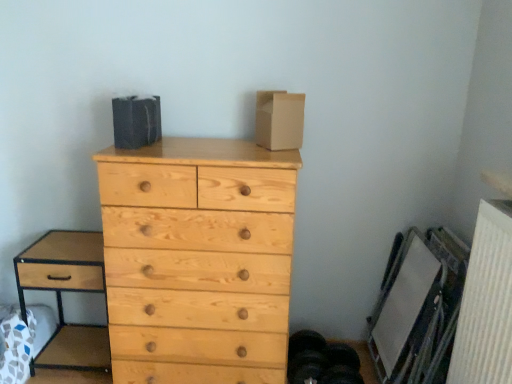
This screenshot has width=512, height=384. What do you see at coordinates (61, 297) in the screenshot?
I see `brown wood nightstand at left` at bounding box center [61, 297].

The image size is (512, 384). I want to click on natural wood chest of drawers at center, so (198, 260).

Measure the distance between natural wood chest of drawers at center and camera.

1.58 meters.

This screenshot has width=512, height=384. In order to click on brown wood nightstand at left in this screenshot , I will do `click(61, 297)`.

Is white textured radiator at lower right aimed at brown cardboard box at upper center?

No, white textured radiator at lower right is not facing towards brown cardboard box at upper center.

Is the surface of white textured radiator at lower right in direct contact with brown cardboard box at upper center?

white textured radiator at lower right and brown cardboard box at upper center are not in contact.

Is point (492, 247) positioned behind point (276, 149)?

No.

Based on the photo, from the image's perspective, who appears lower, brown wood nightstand at left or brown cardboard box at upper center?

From the image's view, brown wood nightstand at left is below.

Does brown wood nightstand at left have a lesser width compared to brown cardboard box at upper center?

No.

From a real-world perspective, is brown wood nightstand at left physically located above or below brown cardboard box at upper center?

In terms of real-world spatial position, brown wood nightstand at left is below brown cardboard box at upper center.

Does brown wood nightstand at left appear on the right side of brown cardboard box at upper center?

Incorrect, brown wood nightstand at left is not on the right side of brown cardboard box at upper center.

From a real-world perspective, is natural wood chest of drawers at center below brown wood nightstand at left?

No, from a real-world perspective, natural wood chest of drawers at center is not under brown wood nightstand at left.

Is natural wood chest of drawers at center aimed at brown wood nightstand at left?

No.

Is point (182, 221) positioned after point (57, 354)?

No.

Is brown cardboard box at upper center facing away from white textured radiator at lower right?

No, brown cardboard box at upper center is not facing away from white textured radiator at lower right.

Considering the relative sizes of brown cardboard box at upper center and white textured radiator at lower right in the image provided, is brown cardboard box at upper center taller than white textured radiator at lower right?

No.

From a real-world perspective, between brown cardboard box at upper center and white textured radiator at lower right, who is vertically higher?

In real-world perspective, brown cardboard box at upper center is above.

Does white textured radiator at lower right appear on the left side of brown wood nightstand at left?

No, white textured radiator at lower right is not to the left of brown wood nightstand at left.

Can you tell me how much white textured radiator at lower right and brown wood nightstand at left differ in facing direction?

90 degrees.

Could you tell me if white textured radiator at lower right is turned towards brown wood nightstand at left?

Yes, white textured radiator at lower right is oriented towards brown wood nightstand at left.

Consider the image. Which object is more forward, white textured radiator at lower right or brown wood nightstand at left?

white textured radiator at lower right is more forward.

Is natural wood chest of drawers at center completely or partially inside brown cardboard box at upper center?

No, natural wood chest of drawers at center is not inside brown cardboard box at upper center.

Is brown cardboard box at upper center touching natural wood chest of drawers at center?

No, brown cardboard box at upper center is not touching natural wood chest of drawers at center.

Could you tell me if brown cardboard box at upper center is facing natural wood chest of drawers at center?

No.

Is brown wood nightstand at left next to natural wood chest of drawers at center and touching it?

brown wood nightstand at left is not next to natural wood chest of drawers at center, and they're not touching.

Is point (110, 361) positioned after point (240, 193)?

Yes, it is.

Could you tell me if brown wood nightstand at left is turned towards natural wood chest of drawers at center?

No, brown wood nightstand at left is not oriented towards natural wood chest of drawers at center.

How distant is brown wood nightstand at left from natural wood chest of drawers at center?

A distance of 19.15 inches exists between brown wood nightstand at left and natural wood chest of drawers at center.

This screenshot has width=512, height=384. Find the location of `cardboard box positioned vertically above the white textured radiator at lower right (from a real-world perspective)`. cardboard box positioned vertically above the white textured radiator at lower right (from a real-world perspective) is located at coordinates (279, 120).

Where is `nightstand below the brown cardboard box at upper center (from the image's perspective)`? This screenshot has width=512, height=384. nightstand below the brown cardboard box at upper center (from the image's perspective) is located at coordinates (61, 297).

When comparing their distances from brown cardboard box at upper center, does white textured radiator at lower right or brown wood nightstand at left seem closer?

white textured radiator at lower right is closer to brown cardboard box at upper center.

From the image, which object appears to be farther from brown cardboard box at upper center, brown wood nightstand at left or white textured radiator at lower right?

brown wood nightstand at left.

From the image, which object appears to be farther from brown wood nightstand at left, natural wood chest of drawers at center or white textured radiator at lower right?

white textured radiator at lower right is further to brown wood nightstand at left.

From the image, which object appears to be nearer to white textured radiator at lower right, brown cardboard box at upper center or natural wood chest of drawers at center?

brown cardboard box at upper center.

Based on their spatial positions, is natural wood chest of drawers at center or brown cardboard box at upper center further from brown wood nightstand at left?

The object further to brown wood nightstand at left is brown cardboard box at upper center.

From the image, which object appears to be nearer to natural wood chest of drawers at center, white textured radiator at lower right or brown wood nightstand at left?

brown wood nightstand at left lies closer to natural wood chest of drawers at center than the other object.

Estimate the real-world distances between objects in this image. Which object is further from brown wood nightstand at left, brown cardboard box at upper center or natural wood chest of drawers at center?

brown cardboard box at upper center lies further to brown wood nightstand at left than the other object.

When comparing their distances from natural wood chest of drawers at center, does brown cardboard box at upper center or white textured radiator at lower right seem closer?

Among the two, brown cardboard box at upper center is located nearer to natural wood chest of drawers at center.

You are a GUI agent. You are given a task and a screenshot of the screen. Output one action in this format:
    pyautogui.click(x=<x>, y=<y>)
    Task: Click on the chest of drawers between brown wood nightstand at left and brown cardboard box at upper center in the horizontal direction
    Image resolution: width=512 pixels, height=384 pixels.
    Given the screenshot: What is the action you would take?
    pos(198,260)

Find the location of a particular element. This screenshot has width=512, height=384. cardboard box between natural wood chest of drawers at center and white textured radiator at lower right from left to right is located at coordinates (279, 120).

The image size is (512, 384). I want to click on cardboard box located between brown wood nightstand at left and white textured radiator at lower right in the left-right direction, so click(x=279, y=120).

Locate an element on the screen. chest of drawers between brown wood nightstand at left and white textured radiator at lower right in the horizontal direction is located at coordinates (198, 260).